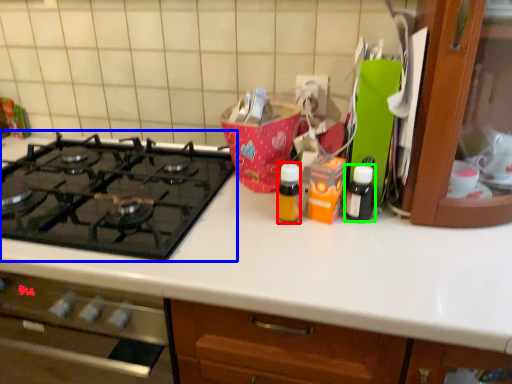
Question: Which object is positioned closest to bottle (highlighted by a red box)? Select from gas stove (highlighted by a blue box) and bottle (highlighted by a green box).

Choices:
 (A) gas stove
 (B) bottle

Answer: (B)